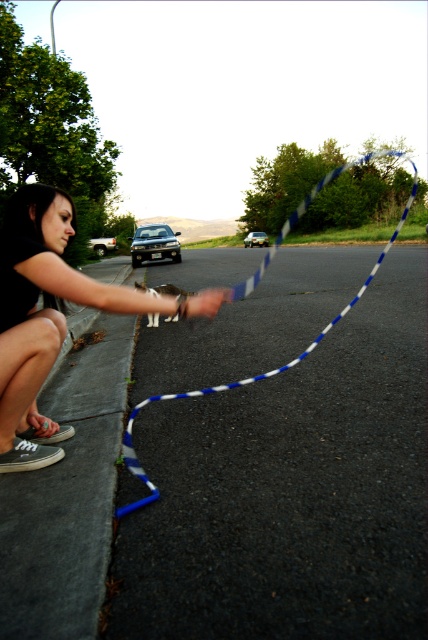
Measure the distance from blue striped rope at center to silver metallic sedan at left.

blue striped rope at center is 37.17 feet away from silver metallic sedan at left.

This screenshot has width=428, height=640. Describe the element at coordinates (240, 380) in the screenshot. I see `blue striped rope at center` at that location.

Is point (350, 300) in front of point (98, 244)?

Yes.

This screenshot has height=640, width=428. I want to click on blue striped rope at center, so click(240, 380).

Who is higher up, matte black sneakers at lower left or silver metallic sedan at left?

silver metallic sedan at left

Does matte black sneakers at lower left have a smaller size compared to silver metallic sedan at left?

Yes, matte black sneakers at lower left is smaller than silver metallic sedan at left.

Is point (33, 420) positioned behind point (109, 244)?

No, (33, 420) is in front of (109, 244).

At what (x,y) coordinates should I click in order to perform the action: click on matte black sneakers at lower left. Please return your answer as a coordinate pair (x, y). The image size is (428, 640). Looking at the image, I should click on (50, 316).

Between matte black sneakers at lower left and satin silver sedan at center, which one is positioned lower?

matte black sneakers at lower left is below.

Measure the distance from matte black sneakers at lower left to satin silver sedan at center.

12.77 meters

The image size is (428, 640). I want to click on matte black sneakers at lower left, so click(x=50, y=316).